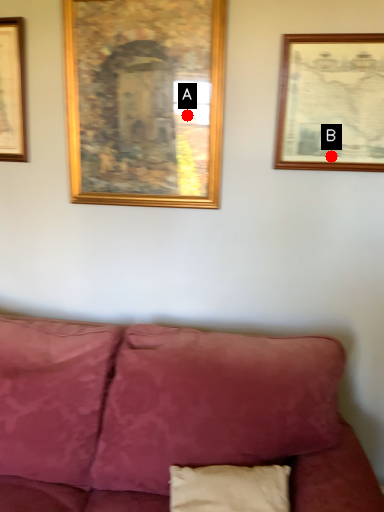
Question: Two points are circled on the image, labeled by A and B beside each circle. Among these points, which one is nearest to the camera?

Choices:
 (A) A is closer
 (B) B is closer

Answer: (B)